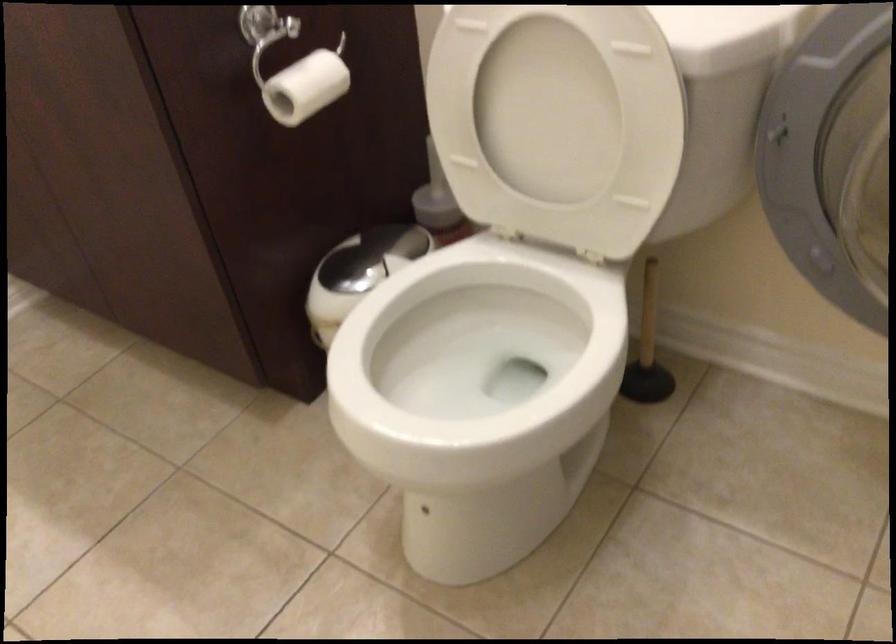
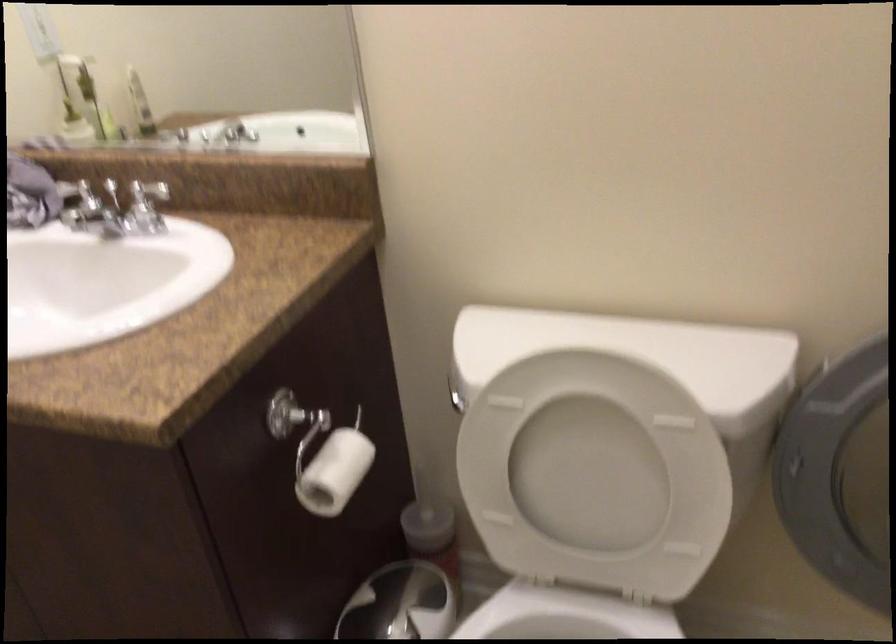
In the second image, find the point that corresponds to point (557, 124) in the first image.

(595, 475)